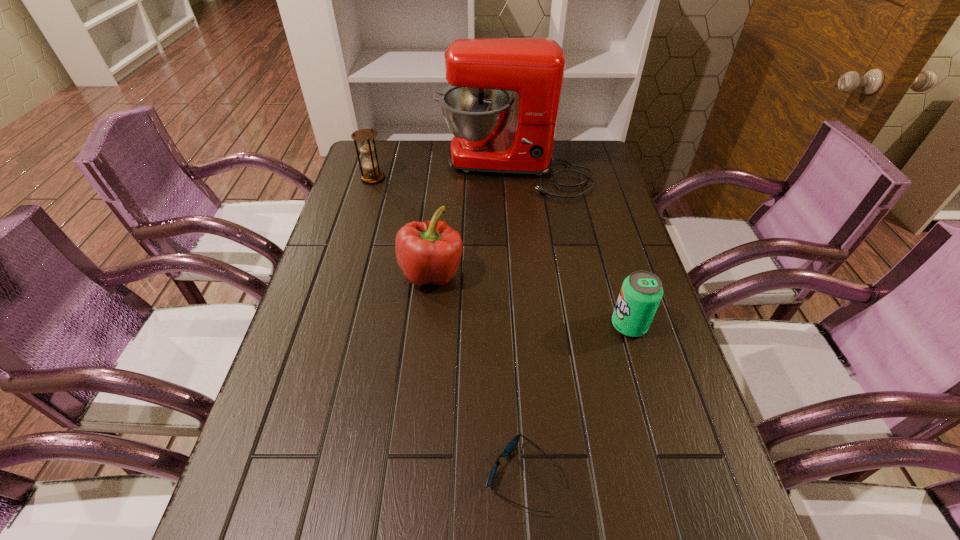
At what (x,y) coordinates should I click in order to perform the action: click on vacant region located 0.280m on the front-facing side of the pop soda. Please return your answer as a coordinate pair (x, y). Looking at the image, I should click on click(x=491, y=325).

Where is `blank space located on the front-facing side of the pop soda`? Image resolution: width=960 pixels, height=540 pixels. blank space located on the front-facing side of the pop soda is located at coordinates coord(577,325).

At what (x,y) coordinates should I click in order to perform the action: click on vacant area located 0.160m at the front of the sunglasses showing the lenses. Please return your answer as a coordinate pair (x, y). Image resolution: width=960 pixels, height=540 pixels. Looking at the image, I should click on (396, 476).

Where is `vacant point located at the front of the sunglasses showing the lenses`? The width and height of the screenshot is (960, 540). vacant point located at the front of the sunglasses showing the lenses is located at coordinates (285, 476).

The image size is (960, 540). Find the location of `vacant region located 0.310m at the front of the sunglasses showing the lenses`. vacant region located 0.310m at the front of the sunglasses showing the lenses is located at coordinates (313, 476).

Find the location of a particular element. kitchen mixer at the far edge is located at coordinates (482, 72).

Identify the location of hourglass present at the far edge. (366, 146).

Identify the location of object at the left edge. Image resolution: width=960 pixels, height=540 pixels. (366, 146).

Identify the location of kitchen mixer located at the right edge. This screenshot has width=960, height=540. (482, 72).

Find the location of a particular element. The height and width of the screenshot is (540, 960). pop soda located in the right edge section of the desktop is located at coordinates (640, 295).